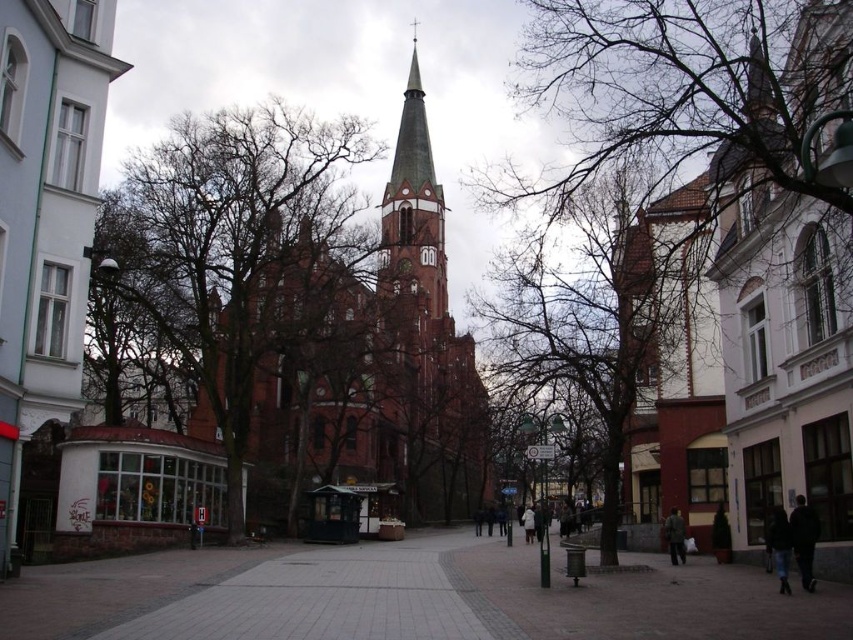
You are standing in the urban scene and see two jackets. The dark blue jacket at lower right and the dark green fabric jacket at center. Which jacket is positioned higher in the image?

The dark blue jacket at lower right is positioned higher than the dark green fabric jacket at center.

You are a city planner assessing the space between the matte brick church at center and the brown leafless tree at center. If you want to install a 50 meter long pedestrian walkway between them, will there be enough space?

The matte brick church at center and brown leafless tree at center are 49.66 meters apart from each other, so the 50 meter long pedestrian walkway will not fit between them as the distance is slightly shorter than required.

You are an architect planning to install a new streetlight in the urban scene. The streetlight needs to be placed between the matte brick church at center and the brown leafless tree at center. Based on their positions, which object should the streetlight be closer to?

The matte brick church at center is positioned over the brown leafless tree at center, meaning the church is in front of the tree. Therefore, the streetlight should be placed closer to the matte brick church at center since it is the closer object to the viewer.